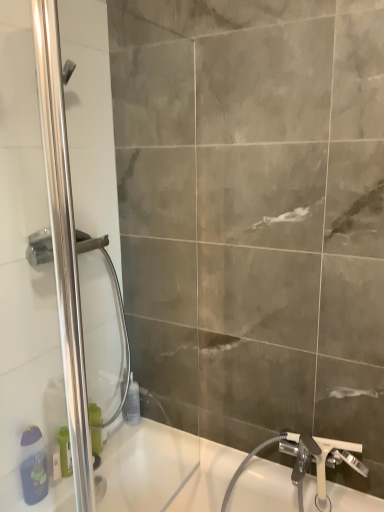
Identify the location of matte purple soap dispenser at lower left, the fourth toiletry from the right. Image resolution: width=384 pixels, height=512 pixels. (33, 466).

The height and width of the screenshot is (512, 384). What do you see at coordinates (132, 404) in the screenshot?
I see `transparent plastic bottle at lower center, the 4th toiletry positioned from the front` at bounding box center [132, 404].

Describe the element at coordinates (96, 440) in the screenshot. Image resolution: width=384 pixels, height=512 pixels. I see `green plastic bottle at lower left, which ranks as the 2th toiletry in back-to-front order` at that location.

Identify the location of white plastic bottle at lower left, which is counted as the third toiletry, starting from the right. Image resolution: width=384 pixels, height=512 pixels. (56, 462).

Is white glossy bathtub at lower left oriented away from white plastic bottle at lower left, which is the second toiletry in left-to-right order?

white glossy bathtub at lower left is not turned away from white plastic bottle at lower left, which is the second toiletry in left-to-right order.

Which is closer to the camera, (137, 460) or (60, 459)?

The point (60, 459) is closer to the camera.

In the scene shown: From a real-world perspective, is white glossy bathtub at lower left over white plastic bottle at lower left, the 3th toiletry viewed from the back?

Actually, white glossy bathtub at lower left is physically below white plastic bottle at lower left, the 3th toiletry viewed from the back, in the real world.

Is white glossy bathtub at lower left shorter than white plastic bottle at lower left, which is the second toiletry in left-to-right order?

In fact, white glossy bathtub at lower left may be taller than white plastic bottle at lower left, which is the second toiletry in left-to-right order.

What's the angular difference between white glossy bathtub at lower left and matte purple soap dispenser at lower left, the 1th toiletry positioned from the front,'s facing directions?

The facing directions of white glossy bathtub at lower left and matte purple soap dispenser at lower left, the 1th toiletry positioned from the front, are 84 degrees apart.

Is matte purple soap dispenser at lower left, the fourth toiletry from the right, at the back of white glossy bathtub at lower left?

No.

Consider the image. How distant is white glossy bathtub at lower left from matte purple soap dispenser at lower left, which appears as the 4th toiletry when viewed from the back?

A distance of 20.21 inches exists between white glossy bathtub at lower left and matte purple soap dispenser at lower left, which appears as the 4th toiletry when viewed from the back.

Which is more to the right, white glossy bathtub at lower left or matte purple soap dispenser at lower left, which appears as the 4th toiletry when viewed from the back?

Positioned to the right is white glossy bathtub at lower left.

From the image's perspective, between matte purple soap dispenser at lower left, the 1th toiletry positioned from the front, and green plastic bottle at lower left, arranged as the 2th toiletry when viewed from the right, who is located below?

From the image's view, matte purple soap dispenser at lower left, the 1th toiletry positioned from the front, is below.

Considering the points (38, 480) and (94, 437), which point is in front, point (38, 480) or point (94, 437)?

The point (38, 480) is closer to the camera.

Does matte purple soap dispenser at lower left, which appears as the 4th toiletry when viewed from the back, have a greater height compared to green plastic bottle at lower left, arranged as the 2th toiletry when viewed from the right?

Yes, matte purple soap dispenser at lower left, which appears as the 4th toiletry when viewed from the back, is taller than green plastic bottle at lower left, arranged as the 2th toiletry when viewed from the right.

Could you measure the distance between matte purple soap dispenser at lower left, the 1th toiletry positioned from the front, and white glossy bathtub at lower left?

A distance of 20.21 inches exists between matte purple soap dispenser at lower left, the 1th toiletry positioned from the front, and white glossy bathtub at lower left.

Is point (36, 466) positioned after point (257, 503)?

No, (36, 466) is in front of (257, 503).

Is matte purple soap dispenser at lower left, arranged as the first toiletry when viewed from the left, not near white glossy bathtub at lower left?

No, there isn't a large distance between matte purple soap dispenser at lower left, arranged as the first toiletry when viewed from the left, and white glossy bathtub at lower left.

Is matte purple soap dispenser at lower left, the 1th toiletry positioned from the front, bigger or smaller than white glossy bathtub at lower left?

Considering their sizes, matte purple soap dispenser at lower left, the 1th toiletry positioned from the front, takes up less space than white glossy bathtub at lower left.

Is transparent plastic bottle at lower center, the 4th toiletry positioned from the front, aimed at white glossy bathtub at lower left?

No, transparent plastic bottle at lower center, the 4th toiletry positioned from the front, is not facing towards white glossy bathtub at lower left.

Looking at this image, is transparent plastic bottle at lower center, acting as the first toiletry starting from the right, with white glossy bathtub at lower left?

No, transparent plastic bottle at lower center, acting as the first toiletry starting from the right, is not with white glossy bathtub at lower left.

Between point (135, 417) and point (110, 468), which one is positioned behind?

Point (135, 417)

Considering the sizes of objects matte purple soap dispenser at lower left, the 1th toiletry positioned from the front, and polished stainless steel shower door at left in the image provided, who is thinner, matte purple soap dispenser at lower left, the 1th toiletry positioned from the front, or polished stainless steel shower door at left?

polished stainless steel shower door at left is thinner.

From the picture: Considering the relative sizes of matte purple soap dispenser at lower left, arranged as the first toiletry when viewed from the left, and polished stainless steel shower door at left in the image provided, is matte purple soap dispenser at lower left, arranged as the first toiletry when viewed from the left, taller than polished stainless steel shower door at left?

No, matte purple soap dispenser at lower left, arranged as the first toiletry when viewed from the left, is not taller than polished stainless steel shower door at left.

Could you tell me if matte purple soap dispenser at lower left, which appears as the 4th toiletry when viewed from the back, is facing polished stainless steel shower door at left?

No, matte purple soap dispenser at lower left, which appears as the 4th toiletry when viewed from the back, is not aimed at polished stainless steel shower door at left.

From the image's perspective, which object appears higher, matte purple soap dispenser at lower left, which appears as the 4th toiletry when viewed from the back, or polished stainless steel shower door at left?

polished stainless steel shower door at left is shown above in the image.

From the image's perspective, would you say white plastic bottle at lower left, the 3th toiletry viewed from the back, is positioned over matte purple soap dispenser at lower left, the 1th toiletry positioned from the front?

No, from the image's perspective, white plastic bottle at lower left, the 3th toiletry viewed from the back, is not above matte purple soap dispenser at lower left, the 1th toiletry positioned from the front.

Could you measure the distance between white plastic bottle at lower left, the 2th toiletry when ordered from front to back, and matte purple soap dispenser at lower left, arranged as the first toiletry when viewed from the left?

white plastic bottle at lower left, the 2th toiletry when ordered from front to back, and matte purple soap dispenser at lower left, arranged as the first toiletry when viewed from the left, are 3.20 inches apart from each other.

Locate an element on the screen. toiletry located on the left of white plastic bottle at lower left, which is counted as the third toiletry, starting from the right is located at coordinates (33, 466).

Is white plastic bottle at lower left, which is counted as the third toiletry, starting from the right, in contact with matte purple soap dispenser at lower left, the fourth toiletry from the right?

Yes.

Find the location of a particular element. the 3rd toiletry counting from the left of the white glossy bathtub at lower left is located at coordinates (56, 462).

I want to click on bath to the right of matte purple soap dispenser at lower left, the 1th toiletry positioned from the front, so [164, 470].

Which object lies further to the anchor point matte purple soap dispenser at lower left, the fourth toiletry from the right, white plastic bottle at lower left, the 3th toiletry viewed from the back, or white glossy bathtub at lower left?

white glossy bathtub at lower left.

Considering their positions, is matte purple soap dispenser at lower left, which appears as the 4th toiletry when viewed from the back, positioned closer to white plastic bottle at lower left, which is the second toiletry in left-to-right order, than white plastic tap at lower right?

Based on the image, matte purple soap dispenser at lower left, which appears as the 4th toiletry when viewed from the back, appears to be nearer to white plastic bottle at lower left, which is the second toiletry in left-to-right order.

Considering their positions, is white glossy bathtub at lower left positioned closer to polished stainless steel shower door at left than transparent plastic bottle at lower center, the 4th toiletry positioned from the front?

transparent plastic bottle at lower center, the 4th toiletry positioned from the front, lies closer to polished stainless steel shower door at left than the other object.

Considering their positions, is matte purple soap dispenser at lower left, the fourth toiletry from the right, positioned further to polished stainless steel shower door at left than green plastic bottle at lower left, acting as the 3th toiletry starting from the left?

green plastic bottle at lower left, acting as the 3th toiletry starting from the left.

Looking at the image, which one is located closer to polished stainless steel shower door at left, transparent plastic bottle at lower center, marked as the first toiletry in a back-to-front arrangement, or white plastic bottle at lower left, which is counted as the third toiletry, starting from the right?

white plastic bottle at lower left, which is counted as the third toiletry, starting from the right.

Based on their spatial positions, is matte purple soap dispenser at lower left, arranged as the first toiletry when viewed from the left, or polished stainless steel shower door at left closer to transparent plastic bottle at lower center, the 4th toiletry positioned from the front?

matte purple soap dispenser at lower left, arranged as the first toiletry when viewed from the left, lies closer to transparent plastic bottle at lower center, the 4th toiletry positioned from the front, than the other object.

From the image, which object appears to be farther from white plastic tap at lower right, transparent plastic bottle at lower center, acting as the first toiletry starting from the right, or white plastic bottle at lower left, the 3th toiletry viewed from the back?

white plastic bottle at lower left, the 3th toiletry viewed from the back.

Which object lies nearer to the anchor point white plastic tap at lower right, white plastic bottle at lower left, the 3th toiletry viewed from the back, or polished stainless steel shower door at left?

white plastic bottle at lower left, the 3th toiletry viewed from the back, lies closer to white plastic tap at lower right than the other object.

Find the location of `toiletry between green plastic bottle at lower left, which appears as the third toiletry when viewed from the front, and white plastic tap at lower right`. toiletry between green plastic bottle at lower left, which appears as the third toiletry when viewed from the front, and white plastic tap at lower right is located at coordinates (132, 404).

Image resolution: width=384 pixels, height=512 pixels. Identify the location of toiletry between white glossy bathtub at lower left and white plastic bottle at lower left, which is the second toiletry in left-to-right order, from front to back. (33, 466).

Where is `tap between white glossy bathtub at lower left and transparent plastic bottle at lower center, which ranks as the fourth toiletry in left-to-right order, in the front-back direction`? tap between white glossy bathtub at lower left and transparent plastic bottle at lower center, which ranks as the fourth toiletry in left-to-right order, in the front-back direction is located at coordinates (318, 460).

This screenshot has width=384, height=512. I want to click on toiletry located between white plastic bottle at lower left, which is counted as the third toiletry, starting from the right, and transparent plastic bottle at lower center, which ranks as the fourth toiletry in left-to-right order, in the depth direction, so click(x=96, y=440).